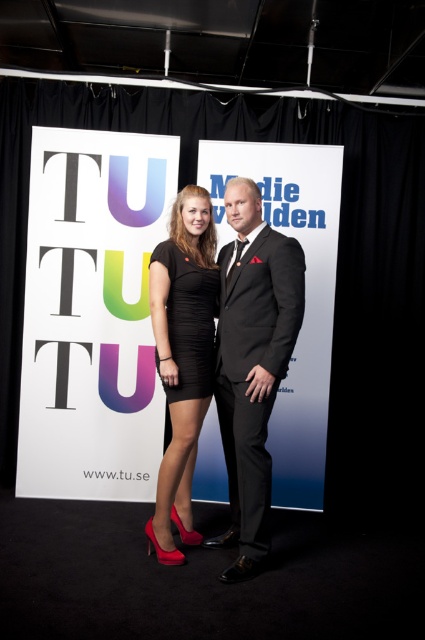
Can you confirm if black satin suit at center is wider than black matte dress at center?

Yes, black satin suit at center is wider than black matte dress at center.

Locate an element on the screen. black satin suit at center is located at coordinates (252, 364).

Between matte black dress at center and black matte dress at center, which one appears on the right side from the viewer's perspective?

Positioned to the right is black matte dress at center.

Which is in front, point (184, 310) or point (195, 365)?

Positioned in front is point (195, 365).

Locate an element on the screen. matte black dress at center is located at coordinates (183, 356).

Image resolution: width=425 pixels, height=640 pixels. What are the coordinates of `matte black dress at center` in the screenshot? It's located at point(183,356).

Between point (263, 320) and point (187, 493), which one is positioned behind?

The point (187, 493) is behind.

Does black satin suit at center have a smaller size compared to matte black dress at center?

Incorrect, black satin suit at center is not smaller in size than matte black dress at center.

Between point (263, 500) and point (176, 388), which one is positioned in front?

Point (263, 500) is in front.

Locate an element on the screen. This screenshot has width=425, height=640. black satin suit at center is located at coordinates (252, 364).